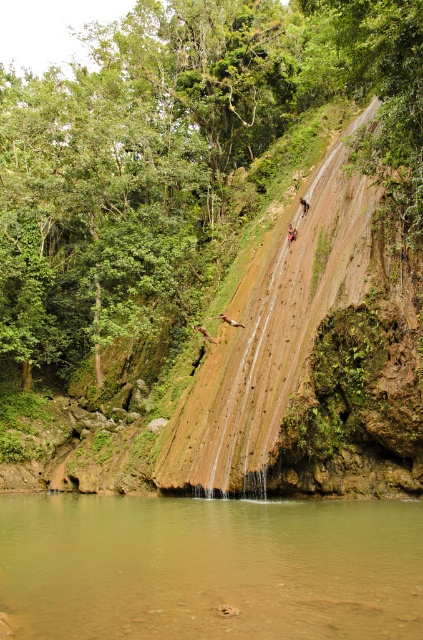
Question: Among these objects, which one is farthest from the camera?

Choices:
 (A) blurred pink shorts at center
 (B) smooth brown rock climber at center

Answer: (B)

Question: Does brown sedimentary rock at lower center come behind smooth brown rock climber at center?

Choices:
 (A) yes
 (B) no

Answer: (B)

Question: Does smooth brown rock climber at center come behind blurred pink shorts at center?

Choices:
 (A) yes
 (B) no

Answer: (A)

Question: Where is brown rough cliff at center located in relation to brown sedimentary rock at lower center in the image?

Choices:
 (A) left
 (B) right

Answer: (B)

Question: Which of the following is the farthest from the observer?

Choices:
 (A) smooth brown rock climber at center
 (B) blurred pink shorts at center
 (C) brown sedimentary rock at lower center
 (D) brown rough cliff at center

Answer: (A)

Question: Which of these objects is positioned closest to the blurred pink shorts at center?

Choices:
 (A) brown sedimentary rock at lower center
 (B) brown rough cliff at center
 (C) smooth brown rock climber at center

Answer: (C)